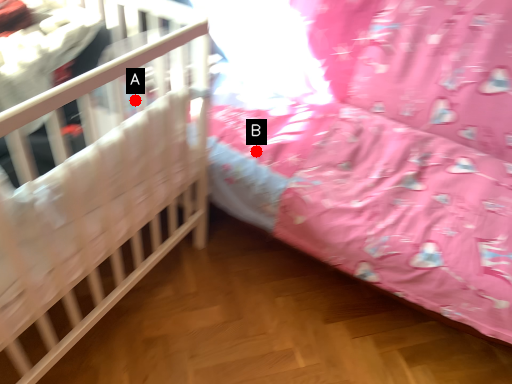
Question: Two points are circled on the image, labeled by A and B beside each circle. Among these points, which one is farthest from the camera?

Choices:
 (A) A is further
 (B) B is further

Answer: (A)